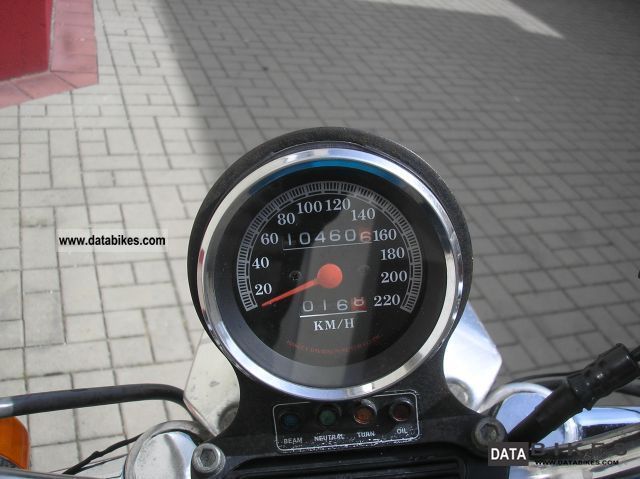
Where is `cable`? cable is located at coordinates [x=93, y=460].